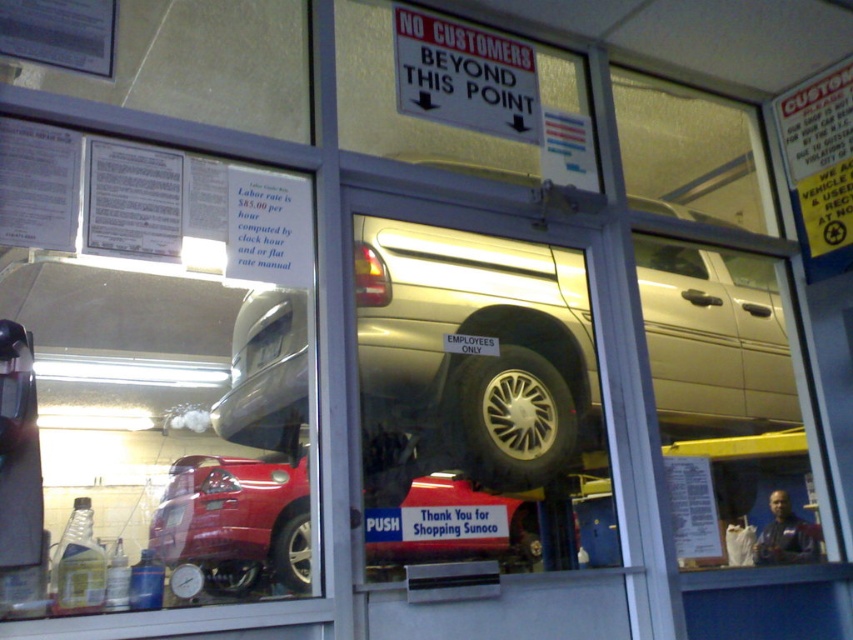
You are a customer who just arrived at the repair shop and see the shiny red car at center and the black rubber tire at lower left. The shop has a policy that only cars larger than a standard tire can be serviced here. Can your car be serviced here?

The shiny red car at center is larger in size than the black rubber tire at lower left. Since the shop requires cars to be larger than a standard tire for service, your car can be serviced here.

You are a customer who just arrived at the repair shop. You see the silver metallic truck at center. Where should you stand to wait for service without violating the shop rules?

The silver metallic truck at center is located at point (x=479, y=336), so you should stand outside the entrance area marked by the signs to avoid crossing into restricted zones.

You are a customer who just entered the repair shop and see the shiny red car at center. The shop has a rule that customers must stay at least 2 meters away from any vehicle. Are you violating the rule?

The shiny red car at center and viewer are 1.87 meters apart, so yes, you are violating the rule because the distance is less than the required 2 meters.